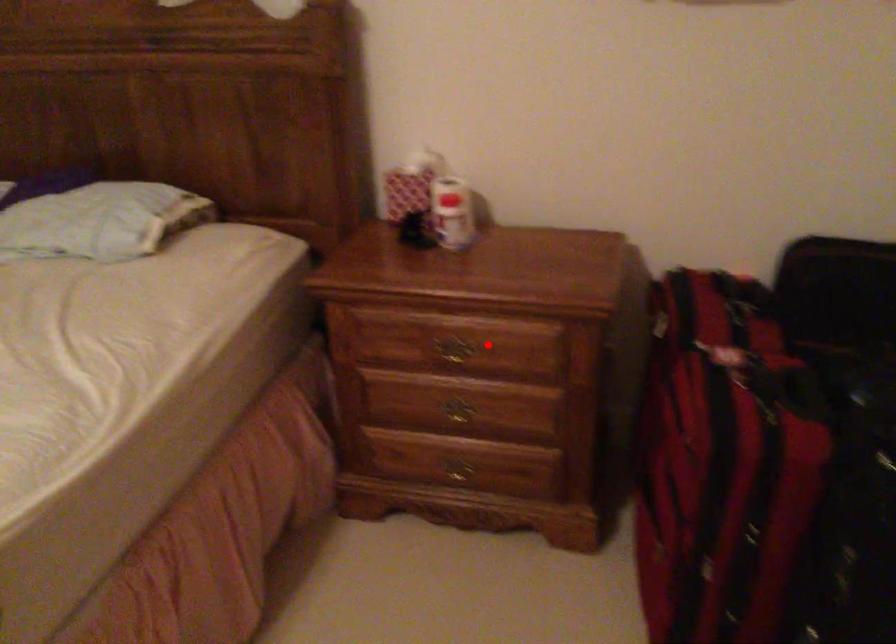
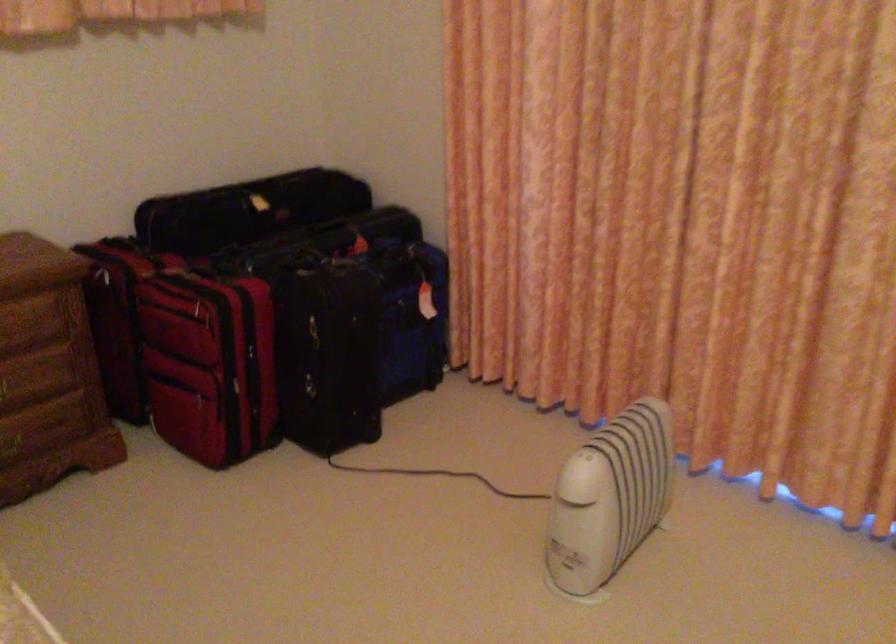
The point at the highlighted location is marked in the first image. Where is the corresponding point in the second image?

(14, 319)